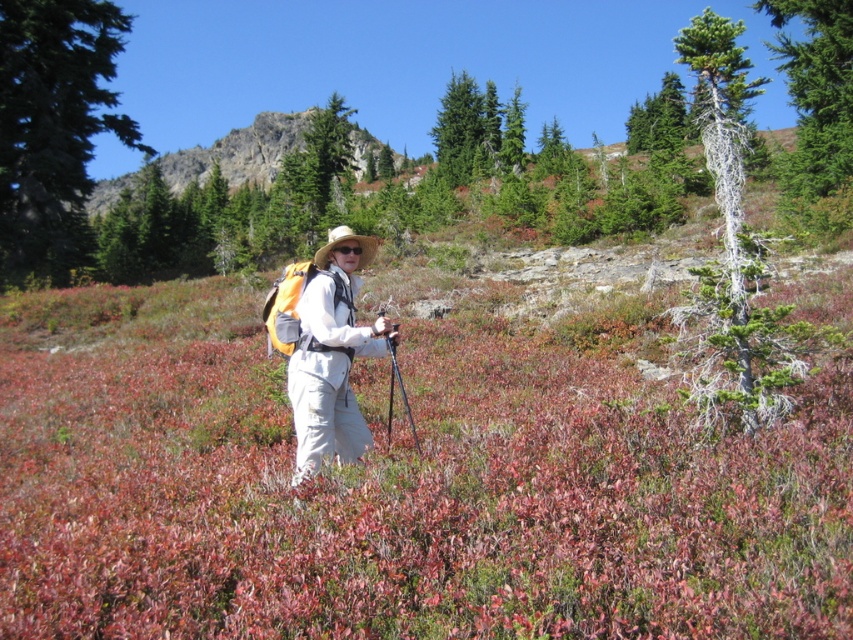
You are a hiker trying to navigate through the field of low vegetation. You see the point marked as point [332,355]. What object does this point correspond to?

The point [332,355] corresponds to the matte white pants at center.

You are a hiker planning to set up a tent. You see a green leafy tree at left and a rugged rock at upper center. Which location would provide better wind protection for your tent?

The rugged rock at upper center would provide better wind protection for your tent because it is thicker than the green leafy tree at left.

You are a drone operator trying to capture the hiker in the image. You need to fly your drone from point A to point B. Point A is at coordinates point (83, 150) and point B is at coordinates point (263, 179). Since the drone must stay above the hiker at all times, which point should you start the drone closer to the hiker?

Point (83, 150) is closer to the viewer than point (263, 179), so you should start the drone closer to point (83, 150) to ensure it stays above the hiker.